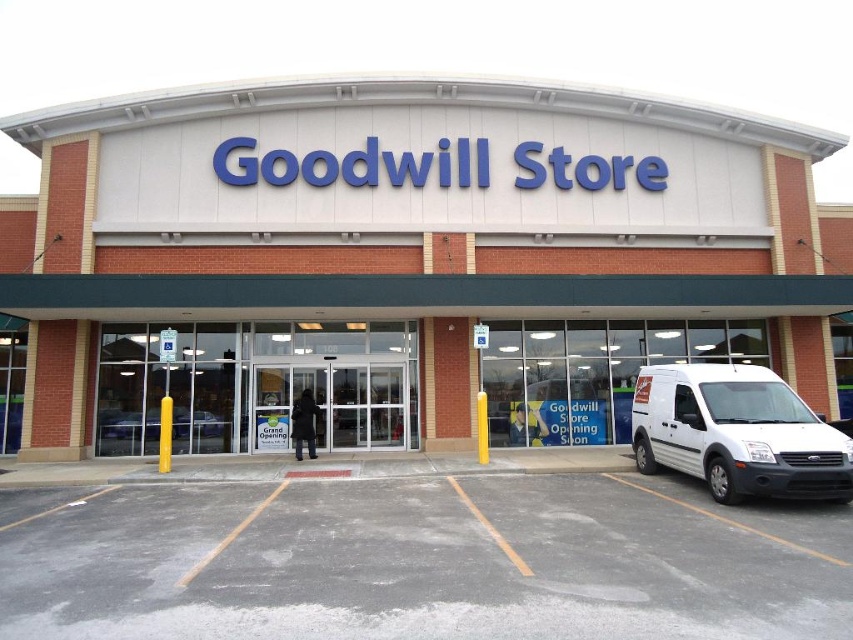
Question: Which of these objects is positioned farthest from the white matte goodwill store at center?

Choices:
 (A) gray asphalt parking lot at center
 (B) white matte van at lower right
 (C) silver metallic sedan at center

Answer: (A)

Question: Is gray asphalt parking lot at center smaller than white matte van at lower right?

Choices:
 (A) yes
 (B) no

Answer: (B)

Question: Which of the following is the closest to the observer?

Choices:
 (A) silver metallic sedan at center
 (B) white matte goodwill store at center
 (C) gray asphalt parking lot at center
 (D) white matte van at lower right

Answer: (C)

Question: Which point is farther to the camera?

Choices:
 (A) silver metallic sedan at center
 (B) white matte van at lower right

Answer: (A)

Question: Does white matte van at lower right appear over silver metallic sedan at center?

Choices:
 (A) no
 (B) yes

Answer: (B)

Question: Does gray asphalt parking lot at center have a greater width compared to white matte van at lower right?

Choices:
 (A) no
 (B) yes

Answer: (B)